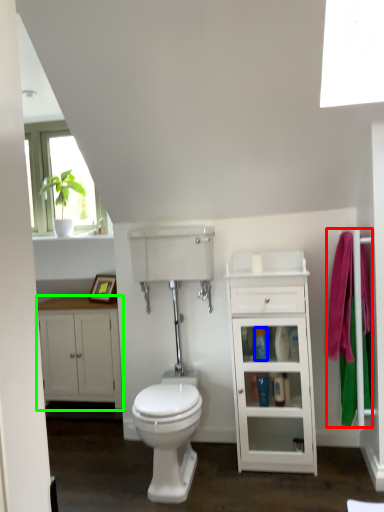
Question: Estimate the real-world distances between objects in this image. Which object is farther from bath towel (highlighted by a red box), toiletry (highlighted by a blue box) or bathroom cabinet (highlighted by a green box)?

Choices:
 (A) toiletry
 (B) bathroom cabinet

Answer: (B)